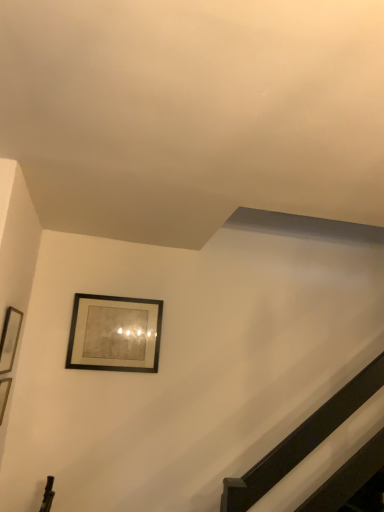
The image size is (384, 512). Describe the element at coordinates (10, 339) in the screenshot. I see `matte black picture frame at left, the 1th picture frame in the front-to-back sequence` at that location.

In order to face matte black picture frame at left, which appears as the 2th picture frame when viewed from the back, should I rotate leftwards or rightwards?

You should look left and rotate roughly 22.911 degrees.

This screenshot has height=512, width=384. What are the coordinates of `matte black picture frame at left, the 1th picture frame from the left` in the screenshot? It's located at (10, 339).

What is the approximate height of matte black picture frame at upper center, the second picture frame positioned from the front?

matte black picture frame at upper center, the second picture frame positioned from the front, is 49.85 centimeters tall.

Describe the element at coordinates (115, 334) in the screenshot. This screenshot has height=512, width=384. I see `matte black picture frame at upper center, arranged as the first picture frame when viewed from the right` at that location.

You are a GUI agent. You are given a task and a screenshot of the screen. Output one action in this format:
    pyautogui.click(x=<x>, y=<y>)
    Task: Click on the matte black picture frame at upper center, arranged as the first picture frame when viewed from the right
    This screenshot has width=384, height=512.
    Given the screenshot: What is the action you would take?
    pyautogui.click(x=115, y=334)

The height and width of the screenshot is (512, 384). I want to click on matte black picture frame at left, which appears as the 2th picture frame when viewed from the back, so click(10, 339).

Is matte black picture frame at left, which appears as the 2th picture frame when viewed from the back, to the left of matte black picture frame at upper center, arranged as the first picture frame when viewed from the right, from the viewer's perspective?

Yes.

Is matte black picture frame at left, the 1th picture frame in the front-to-back sequence, behind matte black picture frame at upper center, the second picture frame in the left-to-right sequence?

No.

Which point is more forward, (2, 357) or (68, 365)?

Positioned in front is point (2, 357).

From the image's perspective, which is below, matte black picture frame at left, placed as the 2th picture frame when sorted from right to left, or matte black picture frame at upper center, the second picture frame positioned from the front?

matte black picture frame at upper center, the second picture frame positioned from the front, appears lower in the image.

From a real-world perspective, is matte black picture frame at left, the 1th picture frame from the left, physically below matte black picture frame at upper center, the second picture frame in the left-to-right sequence?

Yes, from a real-world perspective, matte black picture frame at left, the 1th picture frame from the left, is below matte black picture frame at upper center, the second picture frame in the left-to-right sequence.

In the scene shown: Does matte black picture frame at left, the 1th picture frame from the left, have a greater width compared to matte black picture frame at upper center, arranged as the first picture frame when viewed from the right?

Incorrect, the width of matte black picture frame at left, the 1th picture frame from the left, does not surpass that of matte black picture frame at upper center, arranged as the first picture frame when viewed from the right.

Is matte black picture frame at left, the 1th picture frame from the left, taller or shorter than matte black picture frame at upper center, arranged as the first picture frame when viewed from the back?

Clearly, matte black picture frame at left, the 1th picture frame from the left, is shorter compared to matte black picture frame at upper center, arranged as the first picture frame when viewed from the back.

Can you confirm if matte black picture frame at left, the 1th picture frame from the left, is smaller than matte black picture frame at upper center, arranged as the first picture frame when viewed from the right?

Indeed, matte black picture frame at left, the 1th picture frame from the left, has a smaller size compared to matte black picture frame at upper center, arranged as the first picture frame when viewed from the right.

Is matte black picture frame at left, which appears as the 2th picture frame when viewed from the back, located outside matte black picture frame at upper center, arranged as the first picture frame when viewed from the right?

Yes, matte black picture frame at left, which appears as the 2th picture frame when viewed from the back, is not within matte black picture frame at upper center, arranged as the first picture frame when viewed from the right.

Is matte black picture frame at left, the 1th picture frame from the left, positioned far away from matte black picture frame at upper center, arranged as the first picture frame when viewed from the back?

matte black picture frame at left, the 1th picture frame from the left, is near matte black picture frame at upper center, arranged as the first picture frame when viewed from the back, not far away.

Is matte black picture frame at left, which appears as the 2th picture frame when viewed from the back, facing towards matte black picture frame at upper center, the second picture frame positioned from the front?

No, matte black picture frame at left, which appears as the 2th picture frame when viewed from the back, is not turned towards matte black picture frame at upper center, the second picture frame positioned from the front.

Locate an element on the screen. Image resolution: width=384 pixels, height=512 pixels. picture frame above the matte black picture frame at left, the 1th picture frame in the front-to-back sequence (from a real-world perspective) is located at coordinates (115, 334).

Can you confirm if matte black picture frame at upper center, the second picture frame in the left-to-right sequence, is positioned to the right of matte black picture frame at left, placed as the 2th picture frame when sorted from right to left?

Indeed, matte black picture frame at upper center, the second picture frame in the left-to-right sequence, is positioned on the right side of matte black picture frame at left, placed as the 2th picture frame when sorted from right to left.

Considering the positions of objects matte black picture frame at upper center, arranged as the first picture frame when viewed from the right, and matte black picture frame at left, placed as the 2th picture frame when sorted from right to left, in the image provided, who is in front, matte black picture frame at upper center, arranged as the first picture frame when viewed from the right, or matte black picture frame at left, placed as the 2th picture frame when sorted from right to left,?

Positioned in front is matte black picture frame at left, placed as the 2th picture frame when sorted from right to left.

Between point (131, 368) and point (17, 342), which one is positioned in front?

The point (17, 342) is more forward.

From the image's perspective, is matte black picture frame at upper center, arranged as the first picture frame when viewed from the right, above matte black picture frame at left, the 1th picture frame from the left?

No, from the image's perspective, matte black picture frame at upper center, arranged as the first picture frame when viewed from the right, is not on top of matte black picture frame at left, the 1th picture frame from the left.

From a real-world perspective, which object stands above the other?

matte black picture frame at upper center, arranged as the first picture frame when viewed from the back, is physically above.

Which of these two, matte black picture frame at upper center, arranged as the first picture frame when viewed from the back, or matte black picture frame at left, the 1th picture frame from the left, is wider?

matte black picture frame at upper center, arranged as the first picture frame when viewed from the back, is wider.

Considering the relative sizes of matte black picture frame at upper center, the second picture frame positioned from the front, and matte black picture frame at left, the 1th picture frame in the front-to-back sequence, in the image provided, is matte black picture frame at upper center, the second picture frame positioned from the front, taller than matte black picture frame at left, the 1th picture frame in the front-to-back sequence,?

Yes, matte black picture frame at upper center, the second picture frame positioned from the front, is taller than matte black picture frame at left, the 1th picture frame in the front-to-back sequence.

Considering the relative sizes of matte black picture frame at upper center, arranged as the first picture frame when viewed from the back, and matte black picture frame at left, placed as the 2th picture frame when sorted from right to left, in the image provided, is matte black picture frame at upper center, arranged as the first picture frame when viewed from the back, bigger than matte black picture frame at left, placed as the 2th picture frame when sorted from right to left,?

Yes.

Is matte black picture frame at upper center, the second picture frame in the left-to-right sequence, outside of matte black picture frame at left, the 1th picture frame from the left?

Yes, matte black picture frame at upper center, the second picture frame in the left-to-right sequence, is located beyond the bounds of matte black picture frame at left, the 1th picture frame from the left.

Are matte black picture frame at upper center, arranged as the first picture frame when viewed from the right, and matte black picture frame at left, which appears as the 2th picture frame when viewed from the back, far apart?

No, matte black picture frame at upper center, arranged as the first picture frame when viewed from the right, is not far from matte black picture frame at left, which appears as the 2th picture frame when viewed from the back.

Does matte black picture frame at upper center, arranged as the first picture frame when viewed from the right, turn towards matte black picture frame at left, the 1th picture frame in the front-to-back sequence?

No, matte black picture frame at upper center, arranged as the first picture frame when viewed from the right, is not oriented towards matte black picture frame at left, the 1th picture frame in the front-to-back sequence.

How many degrees apart are the facing directions of matte black picture frame at upper center, arranged as the first picture frame when viewed from the back, and matte black picture frame at left, placed as the 2th picture frame when sorted from right to left?

91.9 degrees separate the facing orientations of matte black picture frame at upper center, arranged as the first picture frame when viewed from the back, and matte black picture frame at left, placed as the 2th picture frame when sorted from right to left.

Where is `picture frame above the matte black picture frame at upper center, arranged as the first picture frame when viewed from the back (from the image's perspective)`? The image size is (384, 512). picture frame above the matte black picture frame at upper center, arranged as the first picture frame when viewed from the back (from the image's perspective) is located at coordinates (10, 339).

Identify the location of picture frame above the matte black picture frame at left, the 1th picture frame in the front-to-back sequence (from a real-world perspective). This screenshot has width=384, height=512. [115, 334].

Locate an element on the screen. picture frame located underneath the matte black picture frame at upper center, the second picture frame in the left-to-right sequence (from a real-world perspective) is located at coordinates (10, 339).